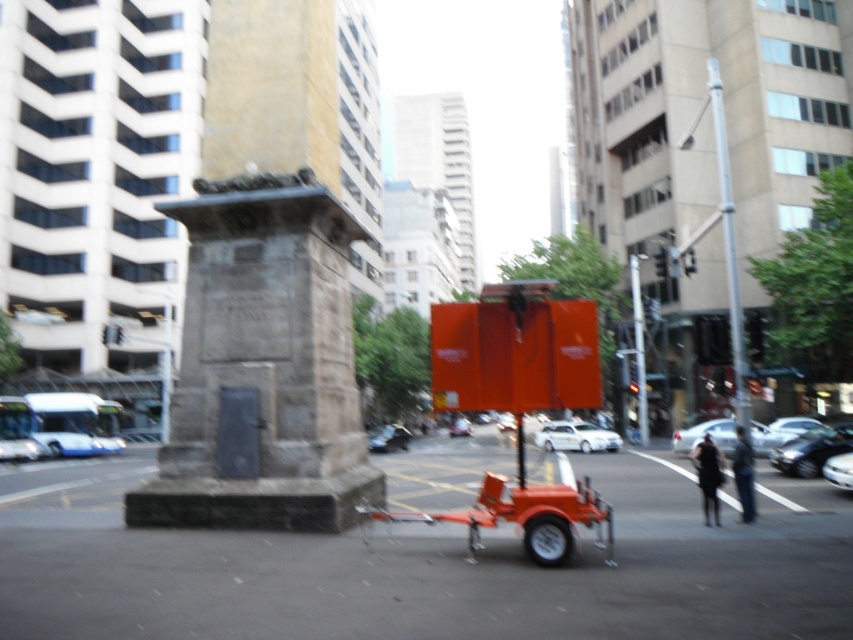
Based on the photo, you are a delivery driver who needs to back up your shiny silver car at center to pick up a package. There is a stone monument at center blocking your path. Can you safely move backward without hitting the monument?

The stone monument at center is positioned over the shiny silver car at center, meaning the monument is directly above the car. Since the car is underneath the monument, you cannot safely back up without risking collision. Choose an alternative route or wait for clearance.

You are a city planner reviewing the urban layout. The stone monument at center is an important historical landmark. If you need to place a new information kiosk exactly 2 meters north of the monument, what are the coordinates of the kiosk based on the monument at center?

The stone monument at center is located at point (263, 365). To place the kiosk 2 meters north, you would add 2 meters to the y coordinate, resulting in coordinates (264, 365). However, without knowing the scale of the coordinate system, precise placement isn